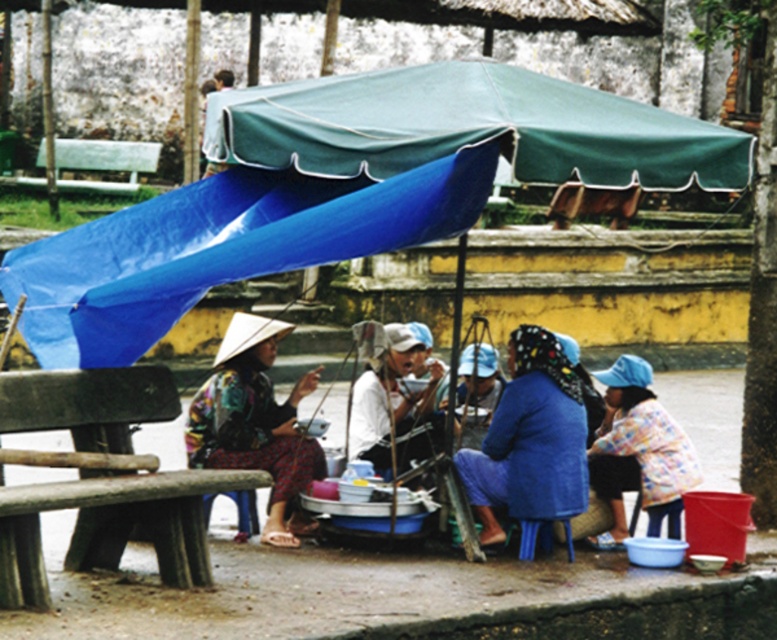
Can you confirm if green fabric canopy at upper center is shorter than wooden bench at lower left?

Yes.

Between point (678, 164) and point (82, 508), which one is positioned behind?

Point (678, 164)

Between point (657, 141) and point (86, 564), which one is positioned behind?

The point (86, 564) is more distant.

Locate an element on the screen. green fabric canopy at upper center is located at coordinates (471, 129).

The image size is (777, 640). Find the location of `matte floral dress at center`. matte floral dress at center is located at coordinates (255, 422).

Is point (211, 436) positioned after point (603, 440)?

No.

Where is `matte floral dress at center`? The height and width of the screenshot is (640, 777). matte floral dress at center is located at coordinates (255, 422).

Who is more distant from viewer, (113, 433) or (58, 179)?

The point (58, 179) is behind.

Can you confirm if wooden bench at lower left is positioned to the left of white wooden bench at left?

In fact, wooden bench at lower left is to the right of white wooden bench at left.

I want to click on wooden bench at lower left, so click(110, 525).